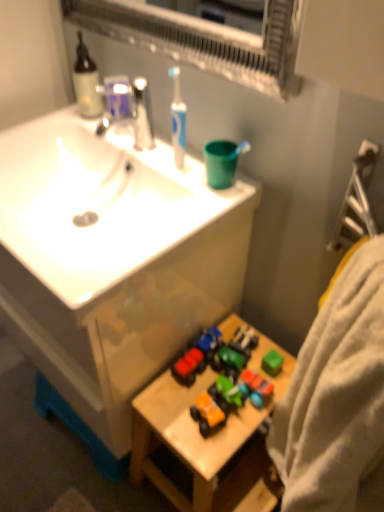
The height and width of the screenshot is (512, 384). I want to click on free space to the left of orange matte toy car at lower center, which appears as the second toy when viewed from the left, so click(170, 411).